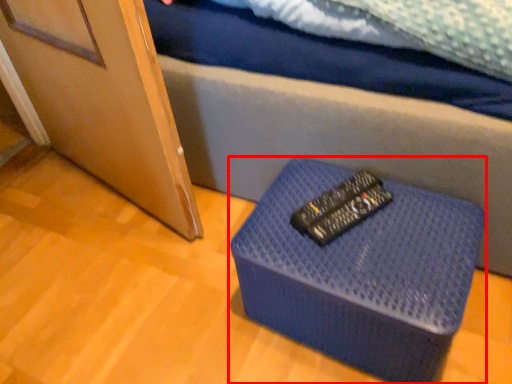
Question: Considering the relative positions of furniture (annotated by the red box) and control in the image provided, where is furniture (annotated by the red box) located with respect to the staircase?

Choices:
 (A) left
 (B) right

Answer: (B)